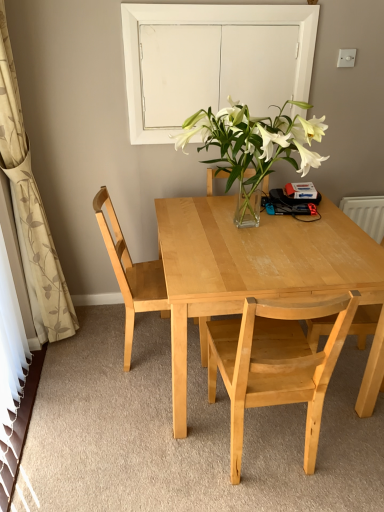
What do you see at coordinates (31, 210) in the screenshot? I see `beige floral fabric curtain at left` at bounding box center [31, 210].

Describe the element at coordinates (370, 354) in the screenshot. This screenshot has height=512, width=384. I see `light wood chair at right, acting as the first chair starting from the right` at that location.

Image resolution: width=384 pixels, height=512 pixels. What do you see at coordinates (131, 274) in the screenshot? I see `light wood chair at left, which ranks as the 1th chair in left-to-right order` at bounding box center [131, 274].

At what (x,y) coordinates should I click in order to perform the action: click on white glass door at upper center. Please return your answer as a coordinate pair (x, y). This screenshot has height=512, width=384. Looking at the image, I should click on (210, 24).

Identify the location of beige floral fabric curtain at left. This screenshot has height=512, width=384. (31, 210).

Is light wood chair at left, which ranks as the 1th chair in left-to-right order, completely or partially inside light wood chair at center, which is the second chair in right-to-left order?

Definitely not — light wood chair at left, which ranks as the 1th chair in left-to-right order, is not inside light wood chair at center, which is the second chair in right-to-left order.

Does light wood chair at center, which is the second chair in right-to-left order, turn towards light wood chair at left, the third chair from the right?

No.

In the scene shown: Can you tell me how much light wood chair at center, arranged as the second chair when viewed from the left, and light wood chair at left, which ranks as the 1th chair in left-to-right order, differ in facing direction?

88.8 degrees separate the facing orientations of light wood chair at center, arranged as the second chair when viewed from the left, and light wood chair at left, which ranks as the 1th chair in left-to-right order.

How distant is light wood chair at center, arranged as the second chair when viewed from the left, from light wood chair at left, the third chair from the right?

light wood chair at center, arranged as the second chair when viewed from the left, and light wood chair at left, the third chair from the right, are 22.75 inches apart from each other.

Can you confirm if light wood chair at right, acting as the first chair starting from the right, is wider than light wood table at center?

Incorrect, the width of light wood chair at right, acting as the first chair starting from the right, does not surpass that of light wood table at center.

Does light wood chair at right, acting as the first chair starting from the right, contain light wood table at center?

No, light wood table at center is not a part of light wood chair at right, acting as the first chair starting from the right.

In the image, is light wood chair at right, acting as the first chair starting from the right, on the left side or the right side of light wood table at center?

light wood chair at right, acting as the first chair starting from the right, is to the right of light wood table at center.

Does light wood chair at right, acting as the first chair starting from the right, turn towards light wood table at center?

Yes, light wood chair at right, acting as the first chair starting from the right, is aimed at light wood table at center.

Is light wood chair at left, which ranks as the 1th chair in left-to-right order, bigger than beige floral fabric curtain at left?

Incorrect, light wood chair at left, which ranks as the 1th chair in left-to-right order, is not larger than beige floral fabric curtain at left.

From the picture: Which is closer, (x=165, y=303) or (x=4, y=138)?

Point (x=165, y=303) is farther from the camera than point (x=4, y=138).

Which of these two, light wood chair at right, acting as the third chair starting from the left, or white glass door at upper center, stands shorter?

white glass door at upper center is shorter.

Considering the sizes of objects light wood chair at right, acting as the first chair starting from the right, and white glass door at upper center in the image provided, who is smaller, light wood chair at right, acting as the first chair starting from the right, or white glass door at upper center?

white glass door at upper center is smaller.

Could you measure the distance between light wood chair at right, acting as the third chair starting from the left, and white glass door at upper center?

A distance of 4.32 feet exists between light wood chair at right, acting as the third chair starting from the left, and white glass door at upper center.

Is light wood chair at right, acting as the first chair starting from the right, facing towards white glass door at upper center?

No.

Consider the image. Between light wood table at center and light wood chair at right, acting as the third chair starting from the left, which one appears on the right side from the viewer's perspective?

light wood chair at right, acting as the third chair starting from the left.

Is light wood table at center spatially inside light wood chair at right, acting as the third chair starting from the left, or outside of it?

light wood table at center is not inside light wood chair at right, acting as the third chair starting from the left, it's outside.

From a real-world perspective, is light wood table at center physically below light wood chair at right, acting as the third chair starting from the left?

Indeed, from a real-world perspective, light wood table at center is positioned beneath light wood chair at right, acting as the third chair starting from the left.

Image resolution: width=384 pixels, height=512 pixels. I want to click on the 1st chair above the light wood table at center (from the image's perspective), so click(x=370, y=354).

Which is correct: beige floral fabric curtain at left is inside light wood chair at right, acting as the first chair starting from the right, or outside of it?

beige floral fabric curtain at left is spatially situated outside light wood chair at right, acting as the first chair starting from the right.

In the image, is beige floral fabric curtain at left positioned in front of or behind light wood chair at right, acting as the third chair starting from the left?

beige floral fabric curtain at left is positioned closer to the viewer than light wood chair at right, acting as the third chair starting from the left.

From a real-world perspective, between beige floral fabric curtain at left and light wood chair at right, acting as the third chair starting from the left, who is vertically higher?

beige floral fabric curtain at left.

Is beige floral fabric curtain at left not near light wood chair at right, acting as the first chair starting from the right?

Yes, beige floral fabric curtain at left and light wood chair at right, acting as the first chair starting from the right, are quite far apart.

Based on the photo, which is more to the left, beige floral fabric curtain at left or light wood chair at center, which is the second chair in right-to-left order?

beige floral fabric curtain at left is more to the left.

Is beige floral fabric curtain at left turned away from light wood chair at center, which is the second chair in right-to-left order?

beige floral fabric curtain at left does not have its back to light wood chair at center, which is the second chair in right-to-left order.

Locate an element on the screen. This screenshot has height=512, width=384. the 3rd chair directly beneath the beige floral fabric curtain at left (from a real-world perspective) is located at coordinates (276, 362).

You are a GUI agent. You are given a task and a screenshot of the screen. Output one action in this format:
    pyautogui.click(x=<x>, y=<y>)
    Task: Click on the 1st chair counting from the right of the light wood chair at left, which ranks as the 1th chair in left-to-right order
    This screenshot has width=384, height=512.
    Given the screenshot: What is the action you would take?
    [x=276, y=362]

Which chair is the 1st one when counting from the back of the light wood table at center? Please provide its 2D coordinates.

[(370, 354)]

From the image, which object appears to be farther from light wood chair at right, acting as the third chair starting from the left, light wood chair at center, which is the second chair in right-to-left order, or light wood table at center?

light wood table at center lies further to light wood chair at right, acting as the third chair starting from the left, than the other object.

Estimate the real-world distances between objects in this image. Which object is closer to white glass door at upper center, light wood chair at center, which is the second chair in right-to-left order, or light wood table at center?

light wood table at center.

Estimate the real-world distances between objects in this image. Which object is further from white glass door at upper center, beige floral fabric curtain at left or light wood chair at left, which ranks as the 1th chair in left-to-right order?

beige floral fabric curtain at left is further to white glass door at upper center.

When comparing their distances from white glass door at upper center, does light wood table at center or light wood chair at left, the third chair from the right, seem further?

light wood table at center is further to white glass door at upper center.

Considering their positions, is light wood chair at center, which is the second chair in right-to-left order, positioned further to light wood chair at left, which ranks as the 1th chair in left-to-right order, than beige floral fabric curtain at left?

The object further to light wood chair at left, which ranks as the 1th chair in left-to-right order, is light wood chair at center, which is the second chair in right-to-left order.

From the image, which object appears to be nearer to light wood table at center, light wood chair at right, acting as the first chair starting from the right, or beige floral fabric curtain at left?

light wood chair at right, acting as the first chair starting from the right.

Looking at the image, which one is located further to light wood chair at center, arranged as the second chair when viewed from the left, light wood table at center or white glass door at upper center?

white glass door at upper center lies further to light wood chair at center, arranged as the second chair when viewed from the left, than the other object.

Looking at the image, which one is located further to beige floral fabric curtain at left, light wood chair at right, acting as the first chair starting from the right, or white glass door at upper center?

light wood chair at right, acting as the first chair starting from the right, is further to beige floral fabric curtain at left.

You are a GUI agent. You are given a task and a screenshot of the screen. Output one action in this format:
    pyautogui.click(x=<x>, y=<y>)
    Task: Click on the kitchen & dining room table between white glass door at upper center and light wood chair at center, which is the second chair in right-to-left order, in the vertical direction
    The height and width of the screenshot is (512, 384).
    Given the screenshot: What is the action you would take?
    pyautogui.click(x=260, y=274)

I want to click on chair located between beige floral fabric curtain at left and light wood chair at center, arranged as the second chair when viewed from the left, in the left-right direction, so click(131, 274).

Where is `kitchen & dining room table between light wood chair at left, which ranks as the 1th chair in left-to-right order, and light wood chair at right, acting as the third chair starting from the left, from left to right`? The image size is (384, 512). kitchen & dining room table between light wood chair at left, which ranks as the 1th chair in left-to-right order, and light wood chair at right, acting as the third chair starting from the left, from left to right is located at coordinates (260, 274).

Locate an element on the screen. The width and height of the screenshot is (384, 512). chair that lies between white glass door at upper center and light wood chair at right, acting as the third chair starting from the left, from top to bottom is located at coordinates (131, 274).